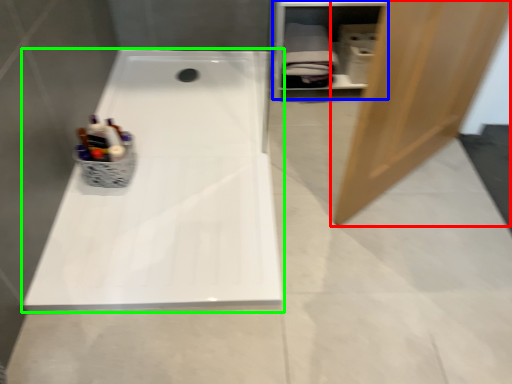
Question: Which object is the farthest from door (highlighted by a red box)? Choose among these: shelf (highlighted by a blue box) or bathtub (highlighted by a green box).

Choices:
 (A) shelf
 (B) bathtub

Answer: (A)